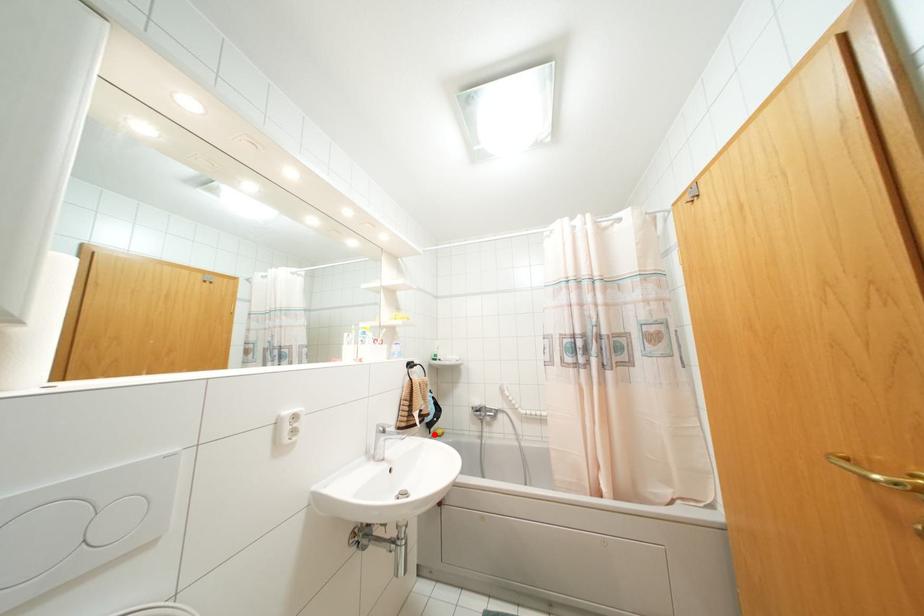
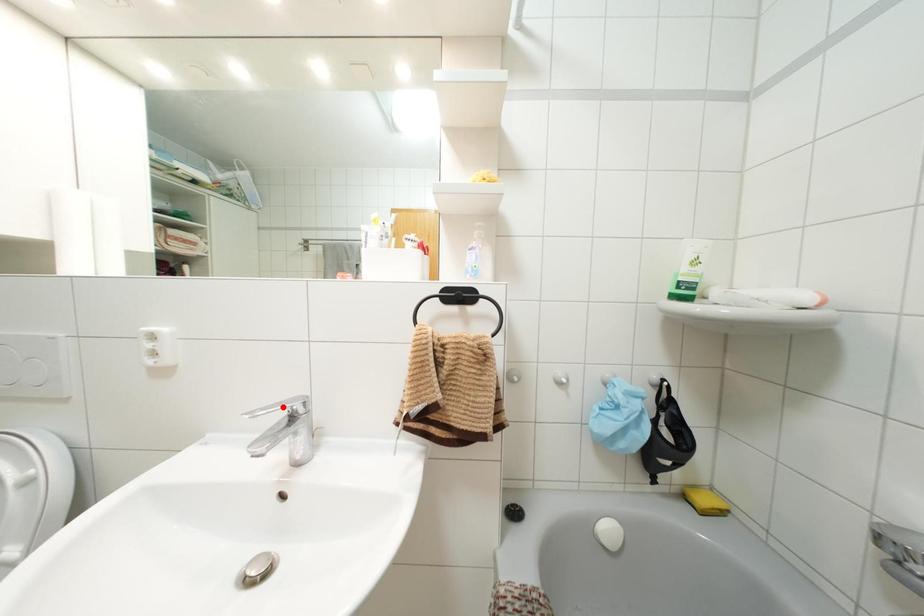
I am providing you with two images of the same scene from different viewpoints. A red point is marked on the first image and another point is marked on the second image. Is the marked point in image1 the same physical position as the marked point in image2?

No